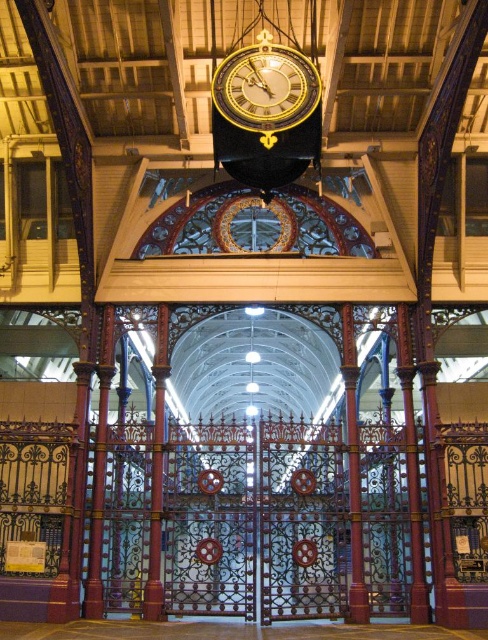
You are a visitor standing at the entrance of the building and want to check the time displayed on the gold metallic clock at center. However, there is a metallic wrought iron gate at lower center in your way. Can you see the clock through the gate?

The gold metallic clock at center is behind the metallic wrought iron gate at lower center, so yes, you can see the clock through the gate since it is positioned behind the gate and the gate is likely made of open wrought iron allowing visibility.

You are a visitor standing at the entrance of the building. You want to walk through the gate. Is the gold metallic clock at center blocking your path to the metallic wrought iron gate at lower center?

The metallic wrought iron gate at lower center is located below the gold metallic clock at center, so the clock is above the gate and not blocking the path. You can walk through the metallic wrought iron gate at lower center without any obstruction from the gold metallic clock at center.

You are standing in the grand hall and need to locate the metallic wrought iron gate at lower center. According to the floor plan, the gate is at coordinates 0.812 on the x and 0.510 on the y. If you are currently at the entrance located at coordinates 0.0, 0.0, in which general direction should you move to reach the gate?

The metallic wrought iron gate at lower center is located at coordinates 0.812 on the x and 0.510 on the y. Since you are at the entrance at (0, 0), you should move towards the positive x and y directions. However, since the x coordinate is significantly higher, the primary direction would be forward along the x axis towards the gate.